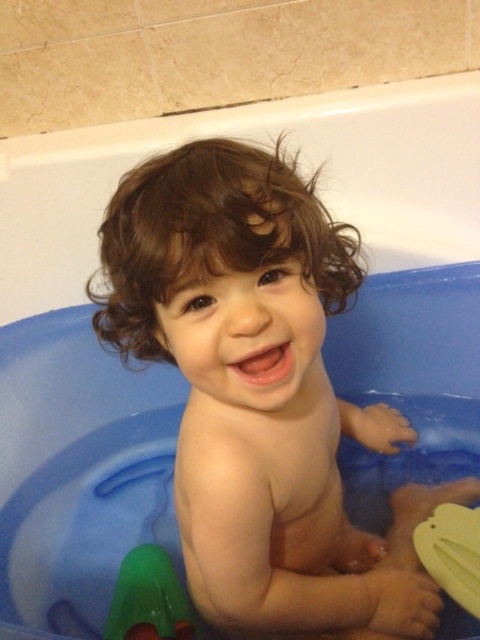
Based on the scene description, where is the smooth skin baby at center located in terms of coordinates?

The smooth skin baby at center is located at coordinates point (260, 394).

You are a parent trying to decide which toy to give to your child first. The green rubber toy at lower left and the yellow rubber duck at lower right are both floating in the bathtub. Which toy is closer to the left side of the bathtub?

The green rubber toy at lower left is positioned on the left side of the yellow rubber duck at lower right, so it is closer to the left side of the bathtub.